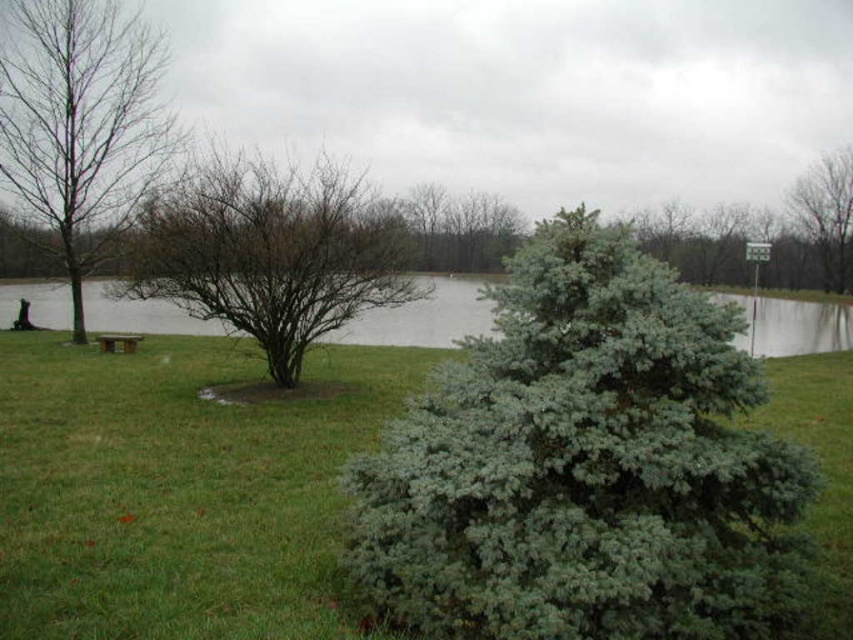
You are an arborist assessing the trees in this scene. You need to determine which tree is taller between the bare wood tree at left and the brown leafless tree at upper right. Based on the scene, which one is taller?

The brown leafless tree at upper right is taller than the bare wood tree at left.